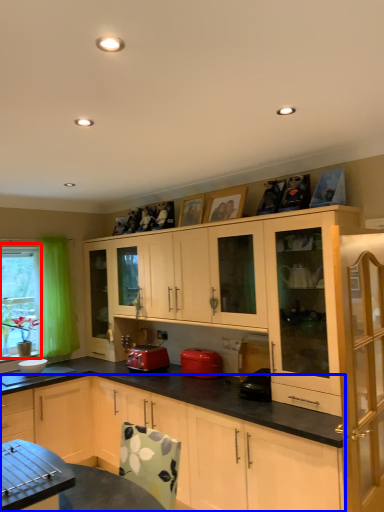
Question: Among these objects, which one is nearest to the camera, bay window (highlighted by a red box) or cabinetry (highlighted by a blue box)?

Choices:
 (A) bay window
 (B) cabinetry

Answer: (B)